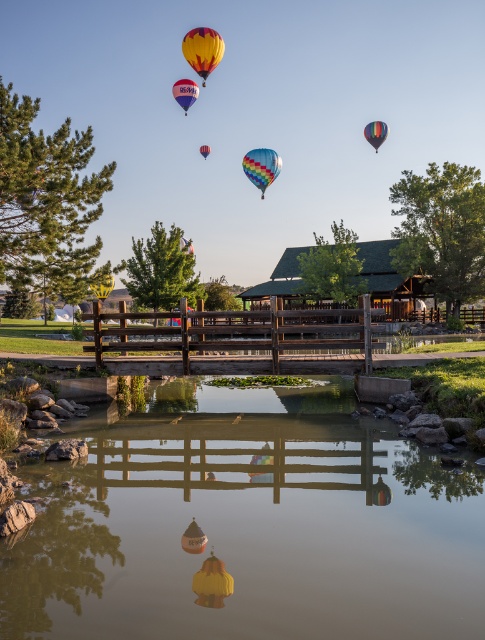
Question: Is multicolored fabric balloon at upper center bigger than multicolored fabric hot air balloon at upper center?

Choices:
 (A) yes
 (B) no

Answer: (A)

Question: Which object is positioned farthest from the yellow and red striped fabric hot air balloon at upper center?

Choices:
 (A) yellow and red striped hot air balloon at upper center
 (B) multicolored fabric balloon at upper center
 (C) multicolored fabric hot air balloon at upper center

Answer: (B)

Question: Which point appears closest to the camera in this image?

Choices:
 (A) (183, 42)
 (B) (201, 152)
 (C) (378, 134)

Answer: (A)

Question: Which of the following is the closest to the observer?

Choices:
 (A) yellow striped fabric hot air balloon at upper center
 (B) yellow and red striped fabric hot air balloon at upper center
 (C) brown wooden bridge at center
 (D) smooth reflective water at center

Answer: (D)

Question: Is yellow and red striped fabric hot air balloon at upper center above rainbow striped balloon at center?

Choices:
 (A) no
 (B) yes

Answer: (B)

Question: Is yellow and red striped fabric hot air balloon at upper center further to camera compared to yellow and red striped hot air balloon at upper center?

Choices:
 (A) no
 (B) yes

Answer: (A)